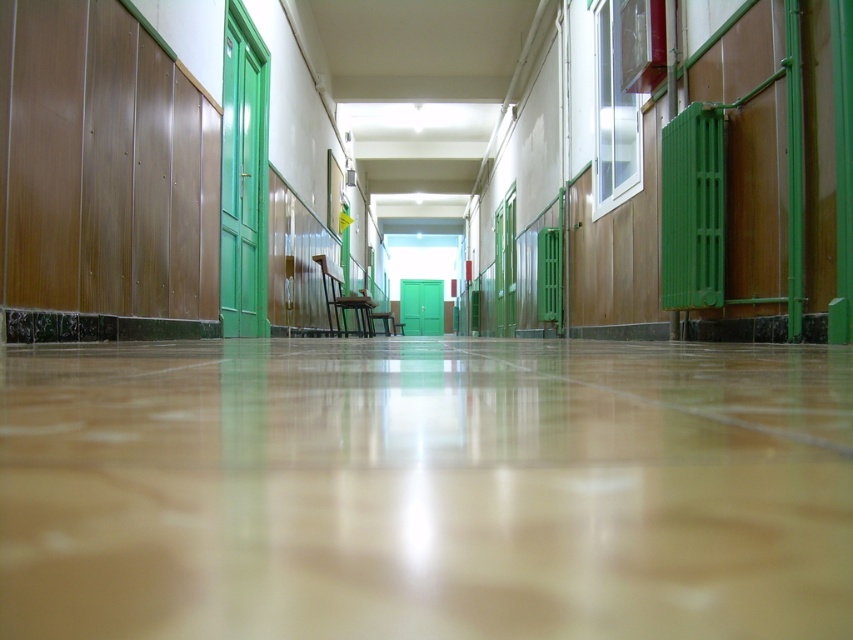
Question: Which point is closer to the camera?

Choices:
 (A) (326, 268)
 (B) (383, 330)

Answer: (A)

Question: Does wooden chair at center have a larger size compared to brown wooden chair at center?

Choices:
 (A) yes
 (B) no

Answer: (A)

Question: Can you confirm if wooden chair at center is positioned to the left of brown wooden chair at center?

Choices:
 (A) no
 (B) yes

Answer: (B)

Question: Is wooden chair at center below brown wooden chair at center?

Choices:
 (A) yes
 (B) no

Answer: (B)

Question: Among these objects, which one is nearest to the camera?

Choices:
 (A) wooden chair at center
 (B) brown wooden chair at center

Answer: (A)

Question: Which point is farther to the camera?

Choices:
 (A) (340, 291)
 (B) (395, 323)

Answer: (B)